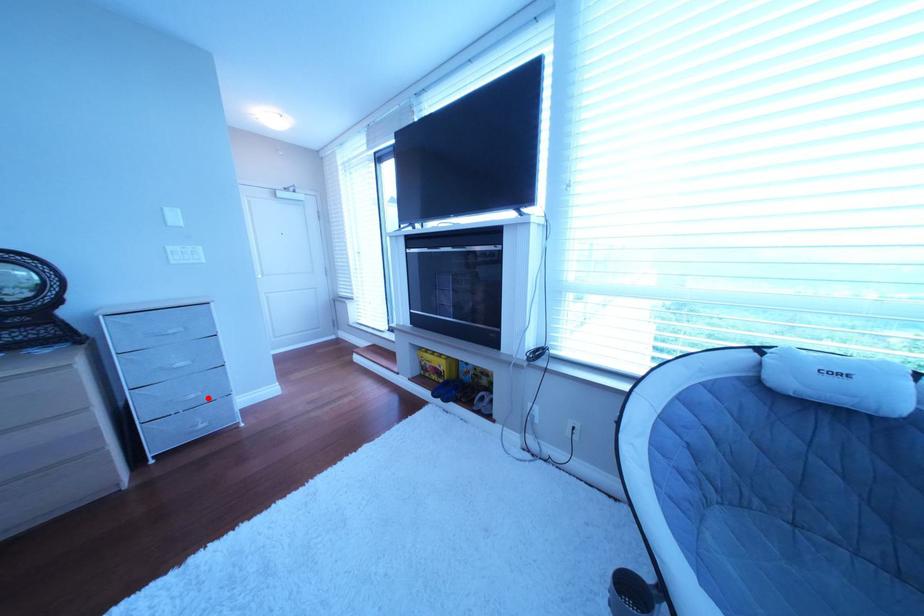
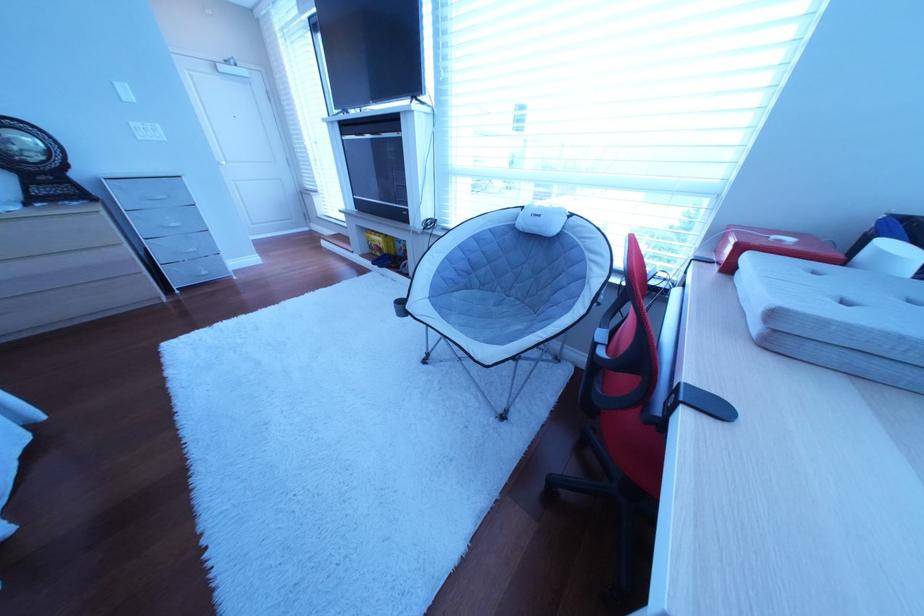
The point at the highlighted location is marked in the first image. Where is the corresponding point in the second image?

(207, 252)